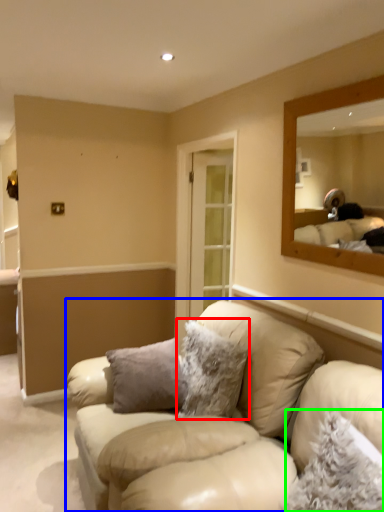
Question: Which object is positioned closest to pillow (highlighted by a red box)? Select from studio couch (highlighted by a blue box) and pillow (highlighted by a green box).

Choices:
 (A) studio couch
 (B) pillow

Answer: (A)